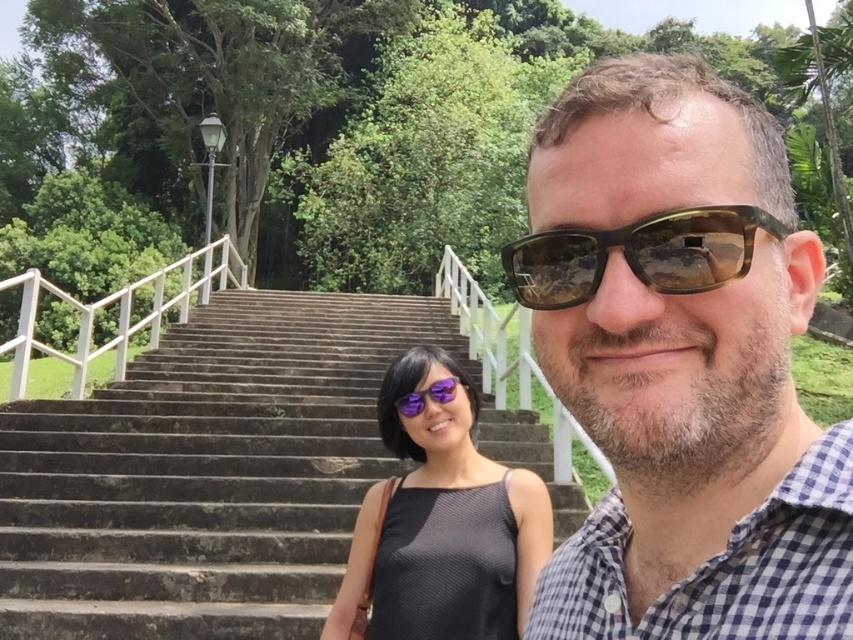
Question: In this image, where is matte black tank top at center located relative to brown translucent goggles at center?

Choices:
 (A) below
 (B) above

Answer: (A)

Question: Can you confirm if stone stairs at center is wider than matte black tank top at center?

Choices:
 (A) no
 (B) yes

Answer: (B)

Question: Which of these objects is positioned closest to the brown checkered shirt at center?

Choices:
 (A) stone stairs at center
 (B) matte black tank top at center

Answer: (B)

Question: Can you confirm if brown checkered shirt at center is thinner than matte black tank top at center?

Choices:
 (A) yes
 (B) no

Answer: (A)

Question: Among these objects, which one is farthest from the camera?

Choices:
 (A) brown checkered shirt at center
 (B) brown translucent goggles at center
 (C) matte black tank top at center

Answer: (C)

Question: Which object is farther from the camera taking this photo?

Choices:
 (A) stone stairs at center
 (B) brown checkered shirt at center
 (C) matte black tank top at center

Answer: (A)